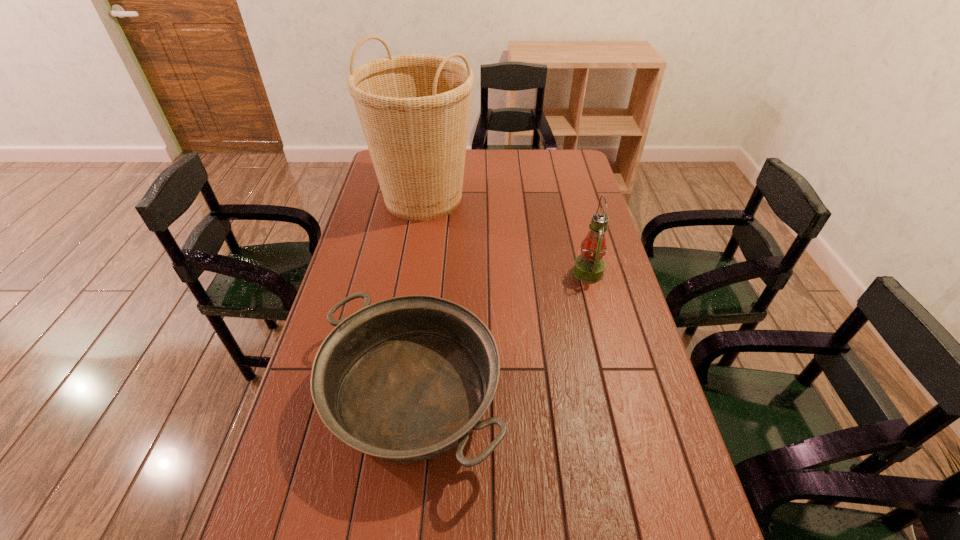
The width and height of the screenshot is (960, 540). Find the location of `vacant space that is in between the shortest object and the rightmost object`. vacant space that is in between the shortest object and the rightmost object is located at coordinates (500, 334).

The height and width of the screenshot is (540, 960). I want to click on object that is the closest to the rightmost object, so click(406, 379).

Locate an element on the screen. object that is the second closest to the oil lamp is located at coordinates coord(414,109).

At what (x,y) coordinates should I click in order to perform the action: click on blank area in the image that satisfies the following two spatial constraints: 1. on the back side of the rightmost object; 2. on the left side of the nearest object. Please return your answer as a coordinate pair (x, y). The width and height of the screenshot is (960, 540). Looking at the image, I should click on (427, 272).